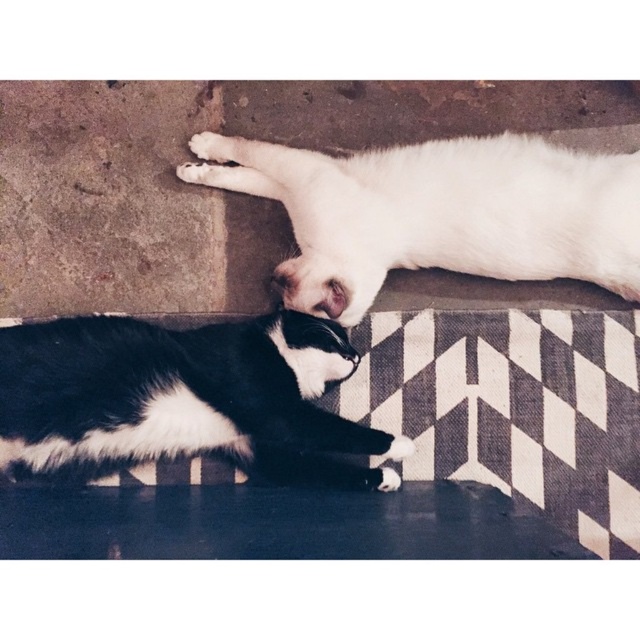
Question: Which object is the closest to the black and white fur cat at lower left?

Choices:
 (A) white fur paw at upper center
 (B) white fluffy cat at upper center

Answer: (B)

Question: Estimate the real-world distances between objects in this image. Which object is closer to the white fluffy cat at upper center?

Choices:
 (A) black and white fur cat at lower left
 (B) white fur paw at upper center

Answer: (A)

Question: Which point is closer to the camera?

Choices:
 (A) (384, 179)
 (B) (186, 328)

Answer: (A)

Question: Considering the relative positions of white fluffy cat at upper center and black and white fur cat at lower left in the image provided, where is white fluffy cat at upper center located with respect to black and white fur cat at lower left?

Choices:
 (A) below
 (B) above

Answer: (B)

Question: Can you confirm if white fluffy cat at upper center is wider than black and white fur cat at lower left?

Choices:
 (A) yes
 (B) no

Answer: (A)

Question: Does black and white fur cat at lower left appear under white fur paw at upper center?

Choices:
 (A) yes
 (B) no

Answer: (A)